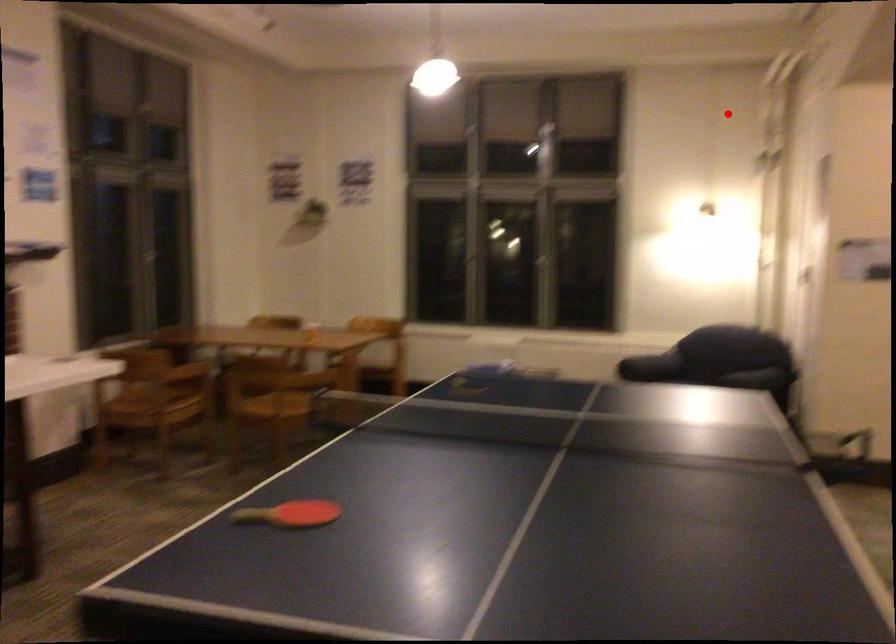
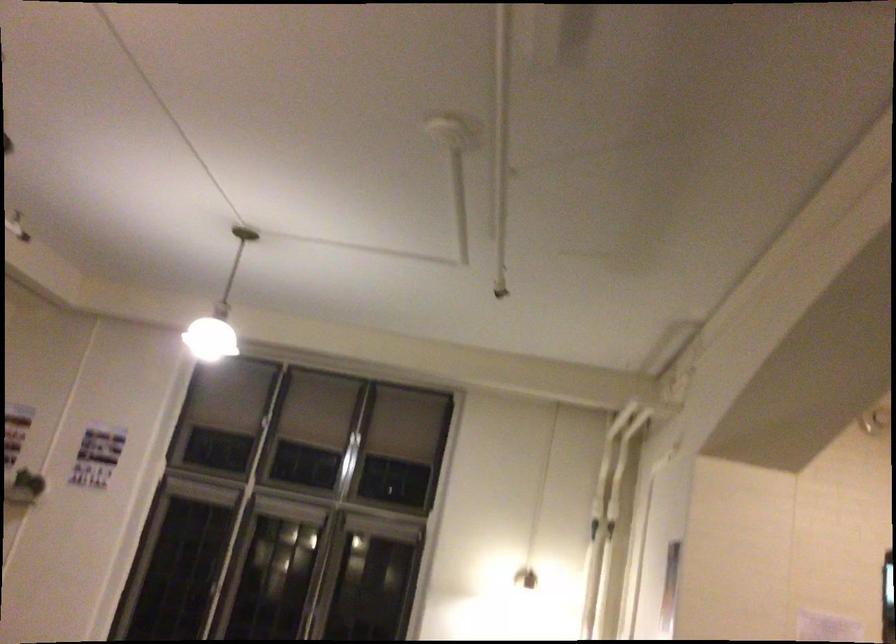
Question: I am providing you with two images of the same scene from different viewpoints. Given a red point in image1, look at the same physical point in image2. Is it:

Choices:
 (A) Closer to the viewpoint
 (B) Farther from the viewpoint

Answer: (A)